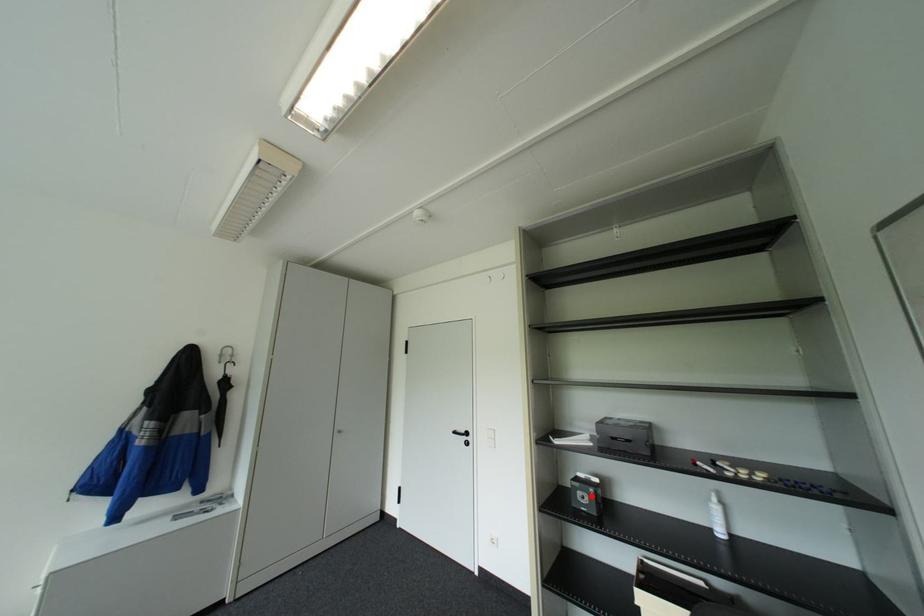
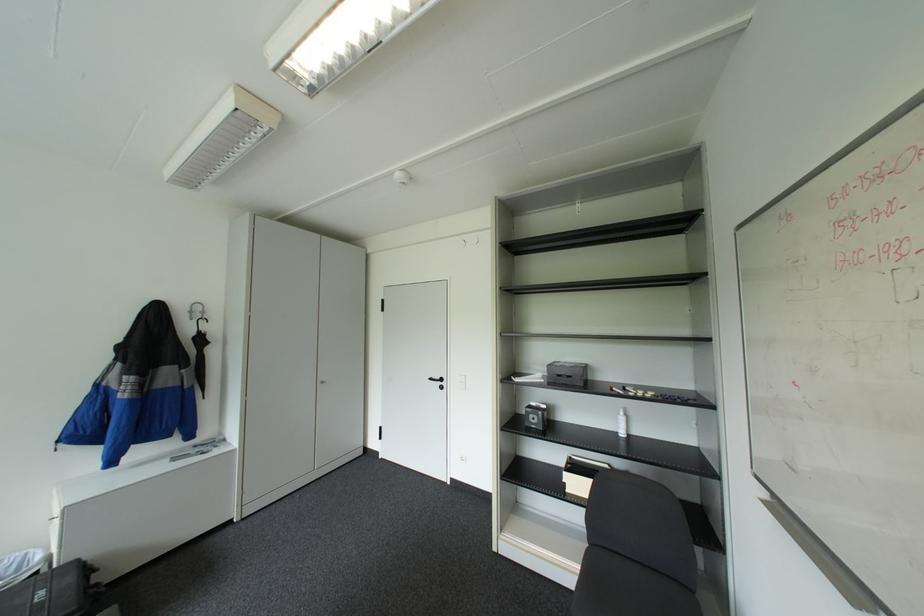
Where in the second image is the point corresponding to the highlighted location from the first image?

(541, 416)